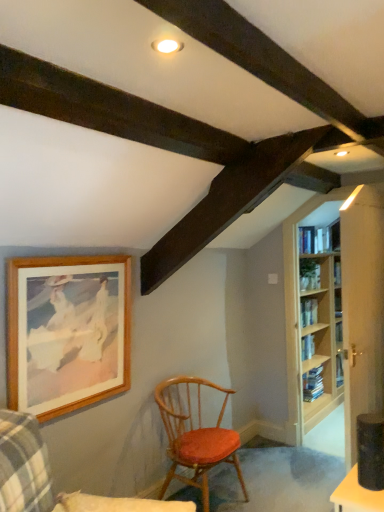
Question: In the image, is light wood bookcase at right positioned in front of or behind wooden chair with red cushion at center, the first chair from the back?

Choices:
 (A) behind
 (B) front

Answer: (A)

Question: Is light wood bookcase at right inside the boundaries of wooden chair with red cushion at center, the first chair from the back, or outside?

Choices:
 (A) outside
 (B) inside

Answer: (A)

Question: Considering the real-world distances, which object is closest to the wooden picture frame at upper left?

Choices:
 (A) wooden chair with red cushion at center, the second chair from the back
 (B) wooden chair with red cushion at center, acting as the 2th chair starting from the front
 (C) light wood bookcase at right

Answer: (A)

Question: Estimate the real-world distances between objects in this image. Which object is farther from the wooden picture frame at upper left?

Choices:
 (A) wooden chair with red cushion at center, the first chair from the front
 (B) light wood bookcase at right
 (C) wooden chair with red cushion at center, acting as the 2th chair starting from the front

Answer: (B)